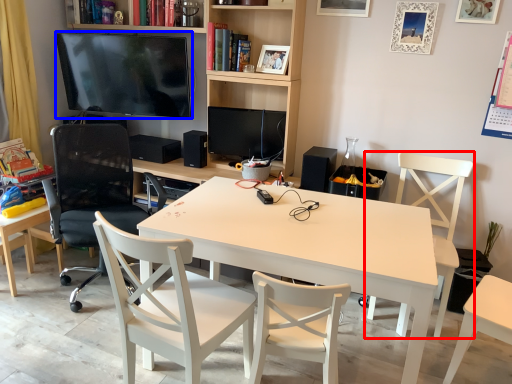
Question: Which object is closer to the camera taking this photo, chair (highlighted by a red box) or television (highlighted by a blue box)?

Choices:
 (A) chair
 (B) television

Answer: (A)